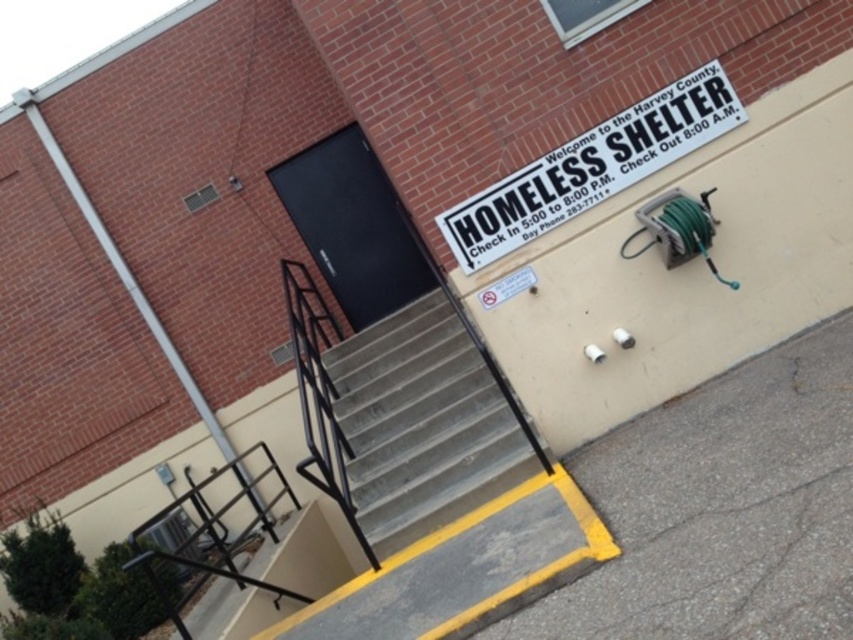
Question: Is concrete stairs at center bigger than black metal/rail at lower left?

Choices:
 (A) yes
 (B) no

Answer: (A)

Question: Is concrete stairs at center bigger than black metal/rail at lower left?

Choices:
 (A) no
 (B) yes

Answer: (B)

Question: Which point appears farthest from the camera in this image?

Choices:
 (A) (454, 214)
 (B) (282, 477)
 (C) (350, 429)

Answer: (B)

Question: Which point appears closest to the camera in this image?

Choices:
 (A) (525, 179)
 (B) (312, 600)

Answer: (A)

Question: Is white plastic sign at upper center below black metal/rail at lower left?

Choices:
 (A) yes
 (B) no

Answer: (B)

Question: Estimate the real-world distances between objects in this image. Which object is farther from the concrete stairs at center?

Choices:
 (A) black metal/rail at lower left
 (B) white plastic sign at upper center

Answer: (A)